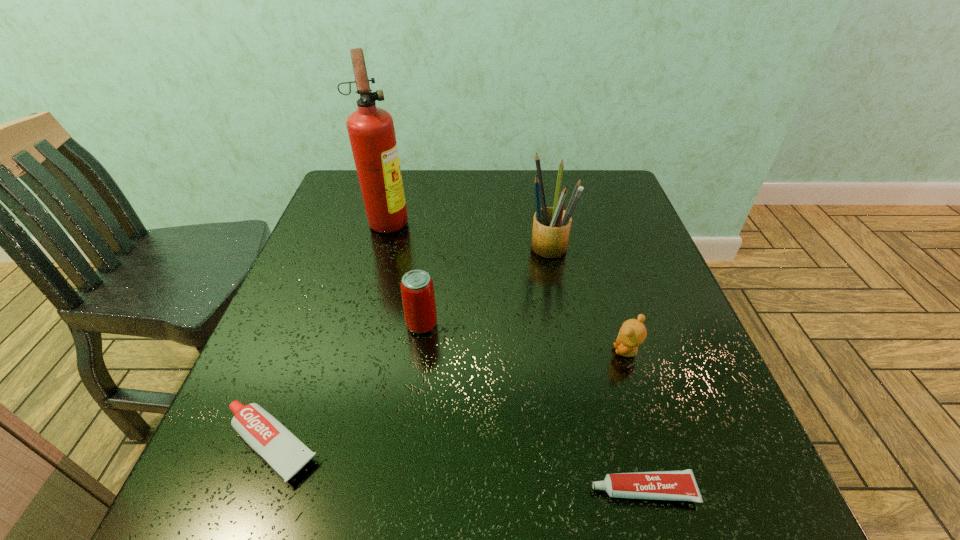
Where is `vacant area located 0.350m on the front-facing side of the tallest object`? The height and width of the screenshot is (540, 960). vacant area located 0.350m on the front-facing side of the tallest object is located at coordinates (538, 220).

Where is `vacant space located on the left of the second tallest object`? The height and width of the screenshot is (540, 960). vacant space located on the left of the second tallest object is located at coordinates (470, 247).

You are a GUI agent. You are given a task and a screenshot of the screen. Output one action in this format:
    pyautogui.click(x=<x>, y=<y>)
    Task: Click on the vacant space located on the front of the third farthest object
    The width and height of the screenshot is (960, 540).
    Given the screenshot: What is the action you would take?
    pyautogui.click(x=396, y=515)

What are the coordinates of `free space located 0.300m on the face of the fourth farthest object` in the screenshot? It's located at (461, 351).

Find the location of a particular element. free space located 0.070m on the face of the fourth farthest object is located at coordinates (578, 351).

Identify the location of free spot located on the face of the fourth farthest object. (435, 351).

Image resolution: width=960 pixels, height=540 pixels. What are the coordinates of `vacant space located on the back of the left toothpaste` in the screenshot? It's located at (331, 281).

The height and width of the screenshot is (540, 960). I want to click on vacant space located at the nozzle of the shortest object, so click(x=539, y=490).

This screenshot has height=540, width=960. What are the coordinates of `vacant space located 0.100m at the nozzle of the shortest object` in the screenshot? It's located at (526, 490).

The height and width of the screenshot is (540, 960). I want to click on vacant space located 0.070m at the nozzle of the shortest object, so click(x=545, y=490).